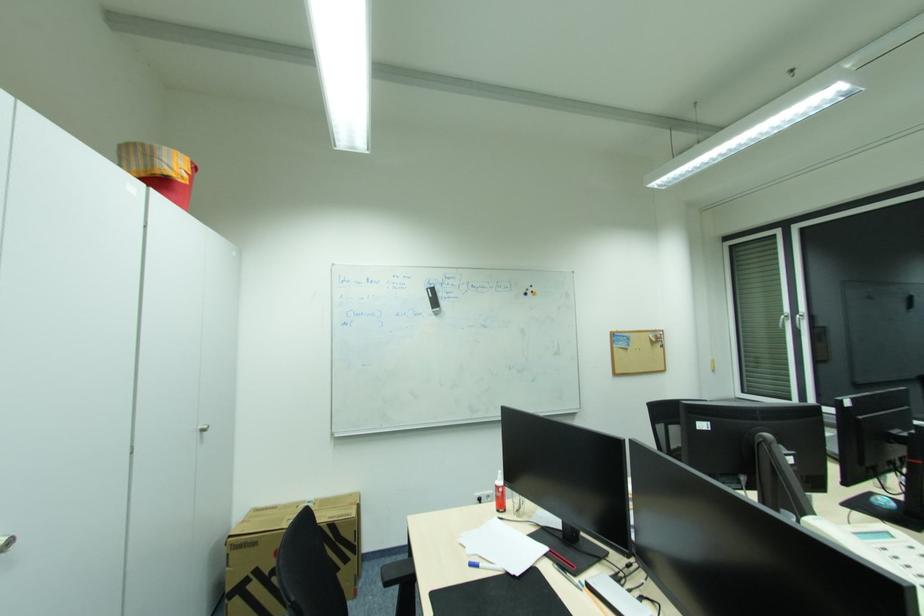
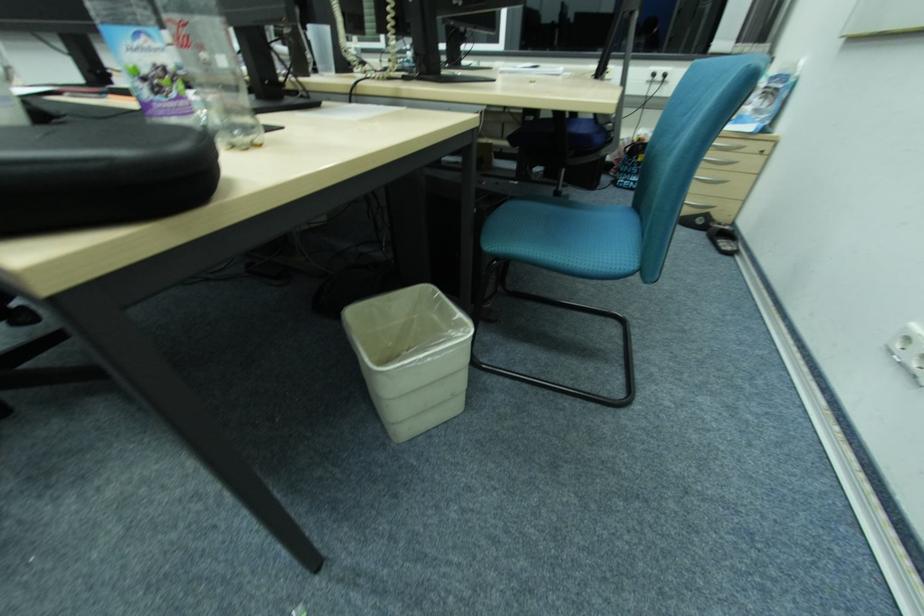
How did the camera likely rotate?

The camera's rotation is toward right-down.